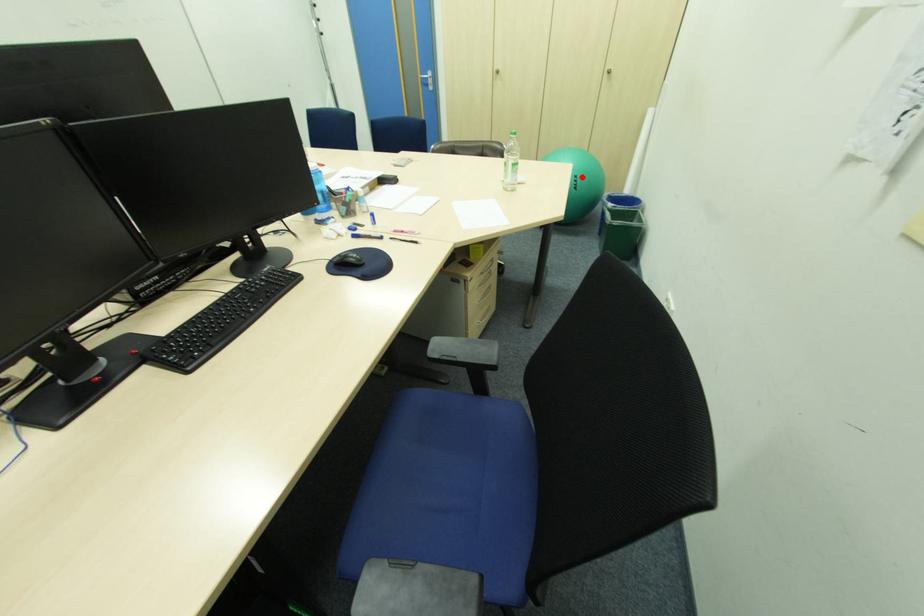
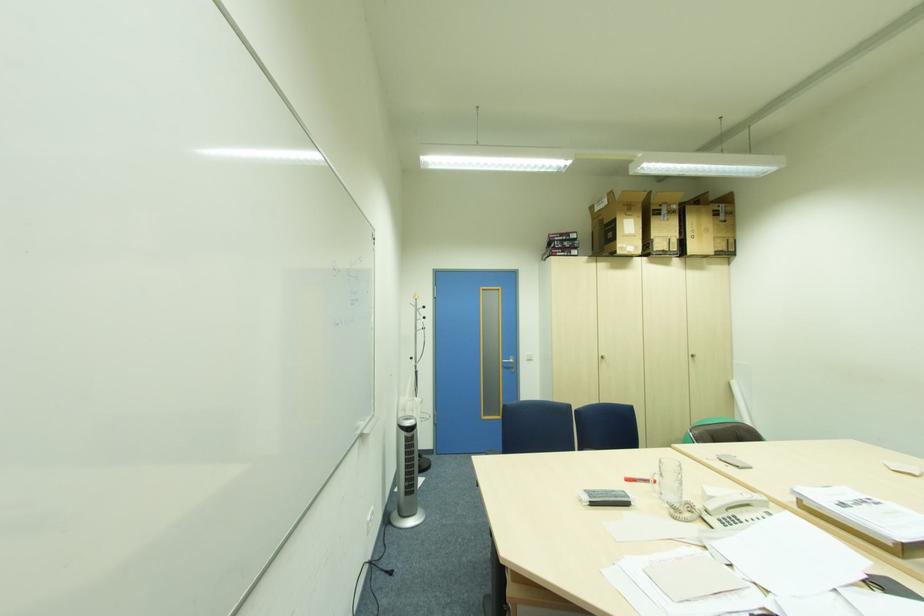
Question: I am providing you with two images of the same scene from different viewpoints. A red point is marked on the first image. Can you still see the location of the red point in image 2?

Choices:
 (A) Yes
 (B) No

Answer: (B)